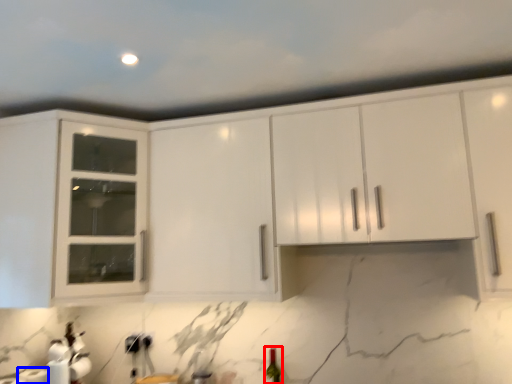
Question: Which object is closer to the camera taking this photo, wine bottle (highlighted by a red box) or paper towel (highlighted by a blue box)?

Choices:
 (A) wine bottle
 (B) paper towel

Answer: (B)